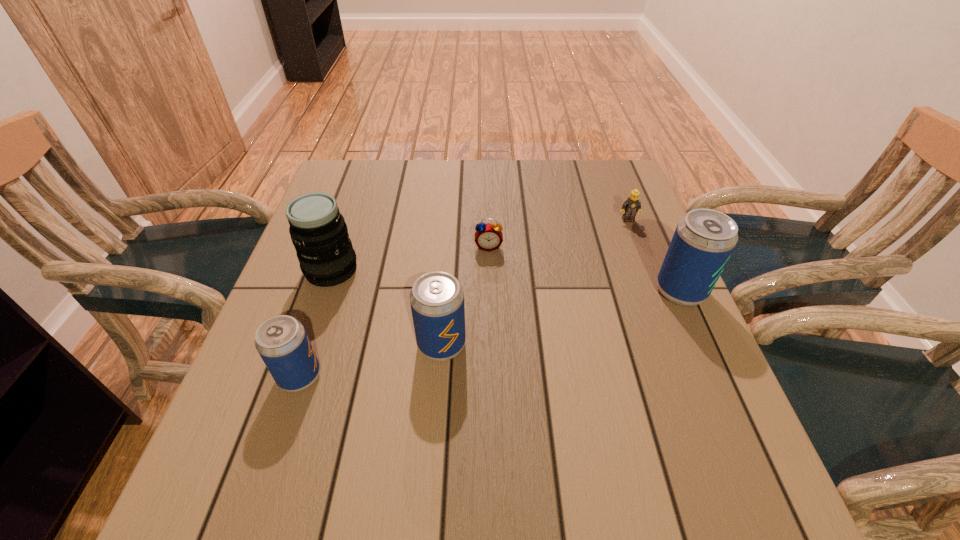
Identify the location of vacant space at the near edge of the desktop. (611, 411).

You are a GUI agent. You are given a task and a screenshot of the screen. Output one action in this format:
    pyautogui.click(x=<x>, y=<y>)
    Task: Click on the vacant space at the left edge of the desktop
    Image resolution: width=960 pixels, height=540 pixels.
    Given the screenshot: What is the action you would take?
    pyautogui.click(x=285, y=308)

This screenshot has height=540, width=960. In order to click on free space at the right edge in this screenshot , I will do click(x=613, y=285).

I want to click on vacant space at the far left corner of the desktop, so click(x=351, y=167).

Where is `blank area at the near right corner`? The height and width of the screenshot is (540, 960). blank area at the near right corner is located at coordinates (732, 434).

Locate an element on the screen. This screenshot has height=540, width=960. vacant space in between the third shortest object and the telephoto lens is located at coordinates (316, 323).

Locate an element on the screen. This screenshot has height=540, width=960. free space between the rightmost beer can and the telephoto lens is located at coordinates (506, 281).

You are a GUI agent. You are given a task and a screenshot of the screen. Output one action in this format:
    pyautogui.click(x=<x>, y=<y>)
    Task: Click on the empty location between the fourth tallest object and the alarm clock
    The image size is (960, 540).
    Given the screenshot: What is the action you would take?
    pyautogui.click(x=395, y=312)

Find the location of a particular element. This screenshot has width=960, height=540. free space between the telephoto lens and the fifth nearest object is located at coordinates click(x=410, y=259).

The width and height of the screenshot is (960, 540). I want to click on vacant area that lies between the farthest beer can and the third shortest object, so click(x=491, y=333).